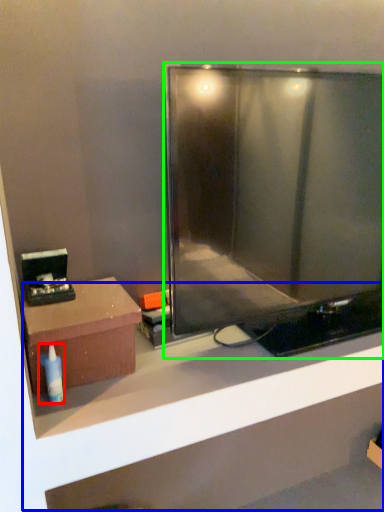
Question: Considering the real-world distances, which object is farthest from toiletry (highlighted by a red box)? shelf (highlighted by a blue box) or television (highlighted by a green box)?

Choices:
 (A) shelf
 (B) television

Answer: (A)